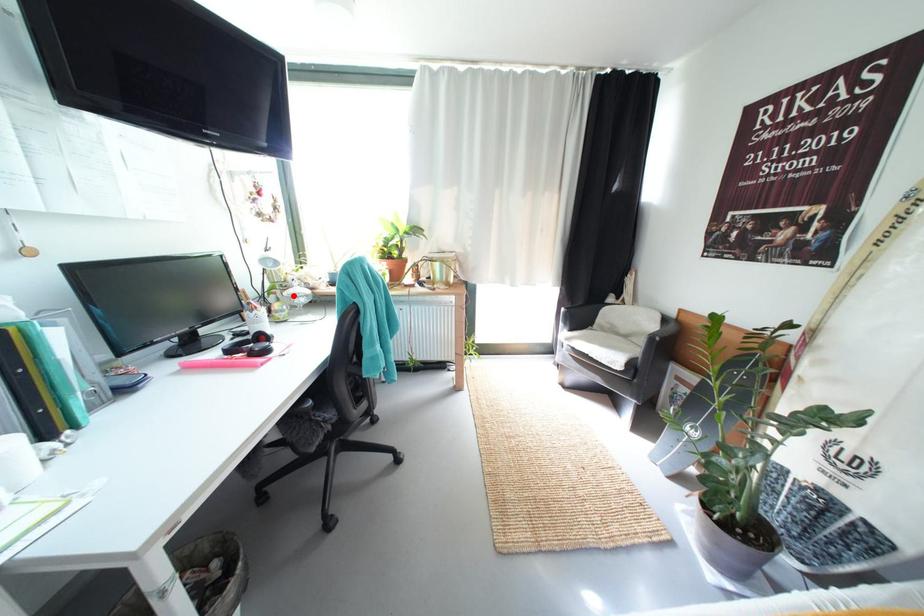
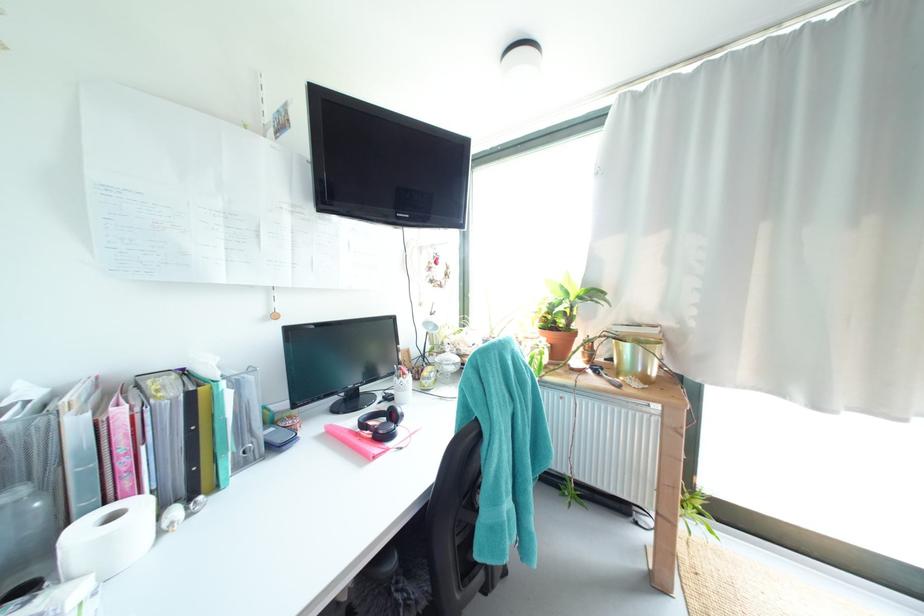
Question: I am providing you with two images of the same scene from different viewpoints. In image1, a red point is highlighted. Considering the same 3D point in image2, which of the following is correct?

Choices:
 (A) It is closer
 (B) It is farther

Answer: (B)